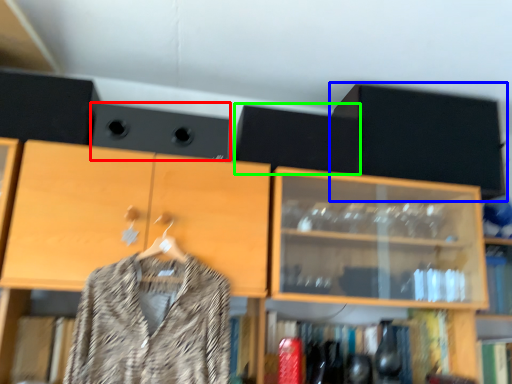
Question: Which object is the closest to the speaker (highlighted by a red box)? Choose among these: cabinetry (highlighted by a blue box) or speaker (highlighted by a green box).

Choices:
 (A) cabinetry
 (B) speaker

Answer: (B)